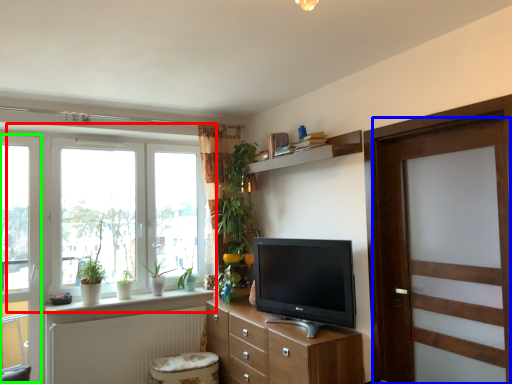
Question: Which object is positioned farthest from window (highlighted by a red box)? Select from door (highlighted by a blue box) and glass door (highlighted by a green box).

Choices:
 (A) door
 (B) glass door

Answer: (A)